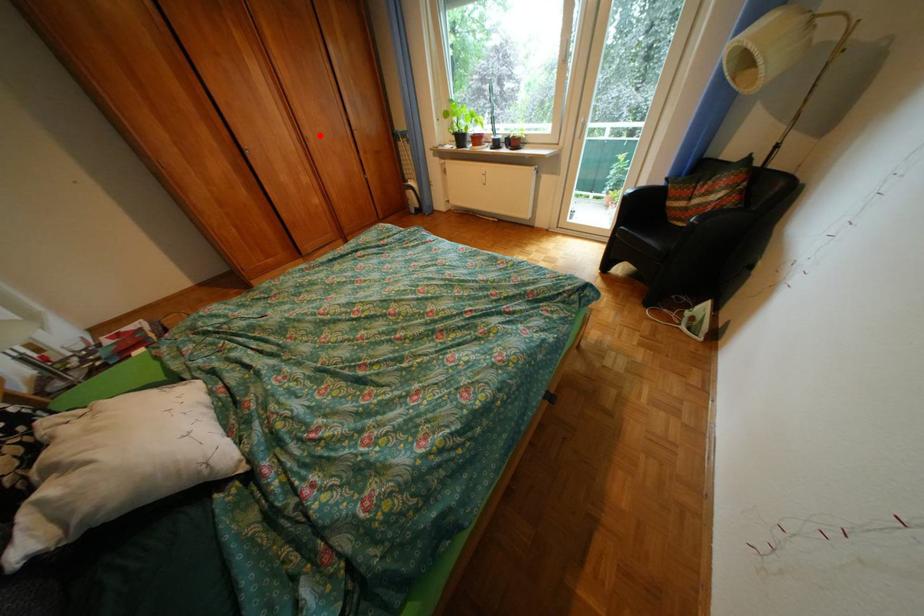
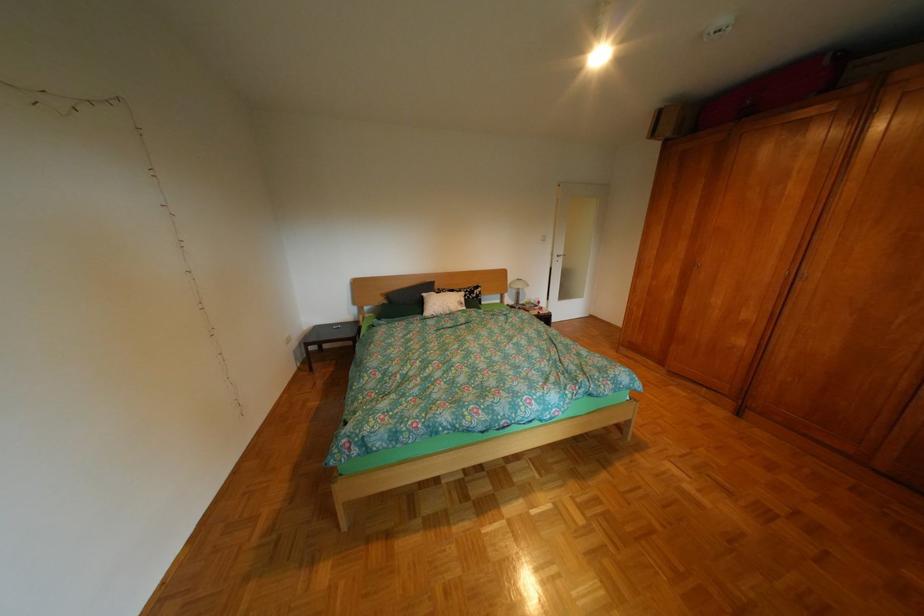
Question: I am providing you with two images of the same scene from different viewpoints. In image1, a red point is highlighted. Considering the same 3D point in image2, which of the following is correct?

Choices:
 (A) It is closer
 (B) It is farther

Answer: (B)